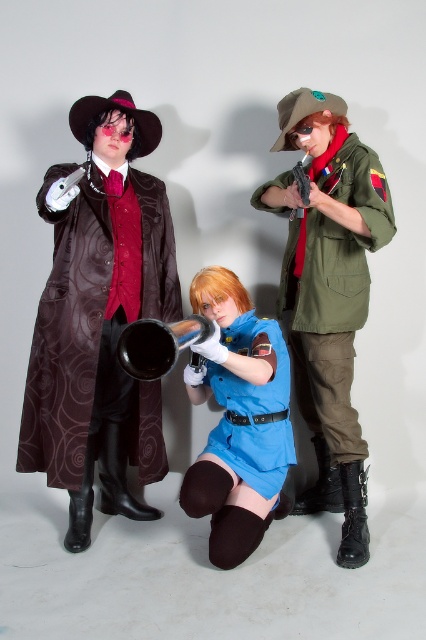
From the picture: You are a photographer setting up for a photoshoot. You need to position two props between the green military jacket at center and the shiny brown coat at left. The props must be placed exactly halfway between them. How far apart should you place the two props from each other?

The distance between the green military jacket at center and the shiny brown coat at left is 21.93 inches. To place the two props exactly halfway between them, each prop should be placed at the midpoint, so the distance between the two props should be 0 inches since they would occupy the same position.

You are a photographer setting up a shoot with the three cosplayers. You need to place a 20 inch wide backdrop stand between the shiny brown coat at left and the black metallic trumpet at center. Will the stand fit between them without overlapping either object?

The distance between the shiny brown coat at left and the black metallic trumpet at center is 19.69 inches. Since the backdrop stand is 20 inches wide, it will not fit between them as the space is slightly narrower than the stand.

You are a photographer trying to capture a group photo of the cosplayers. You need to ensure that the light blue fabric vest at center and the black metallic trumpet at center are both visible in the frame. Based on their positions, which object should you focus on first to ensure both are in the shot?

The light blue fabric vest at center is to the right of the black metallic trumpet at center, so focusing on the central area where both are positioned will ensure both are visible in the frame.